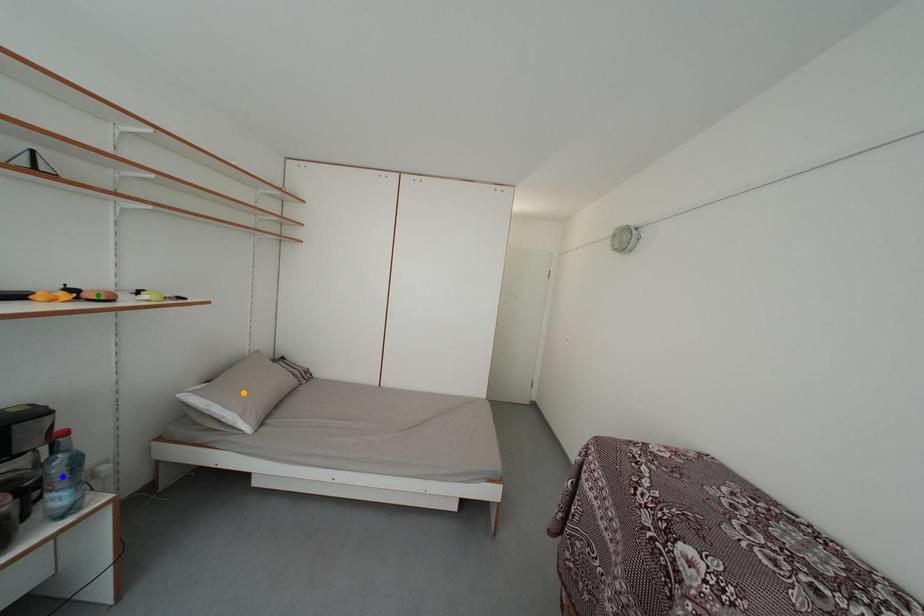
Order these from nearest to farthest:
green point | blue point | orange point

blue point → green point → orange point